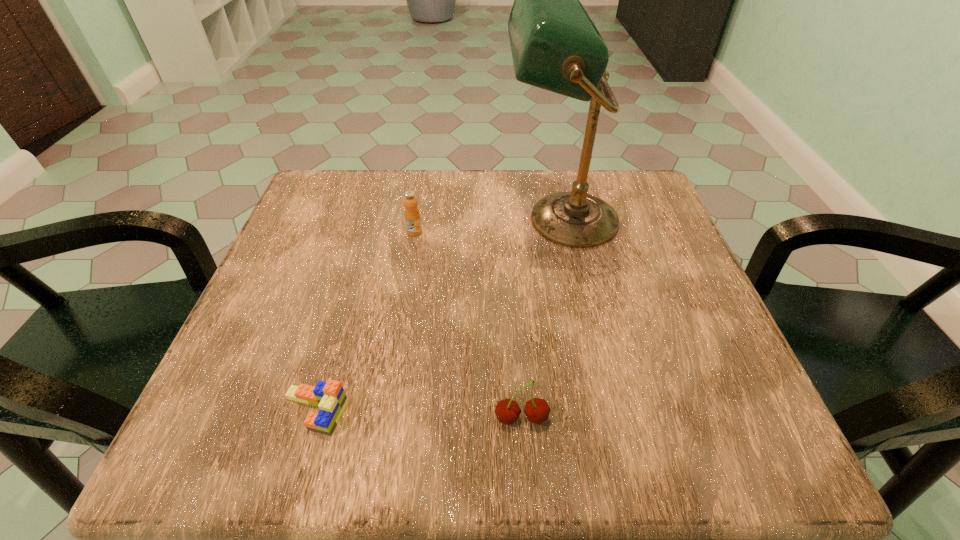
Identify the location of table lamp that is at the far edge. Image resolution: width=960 pixels, height=540 pixels. (555, 46).

At what (x,y) coordinates should I click in order to perform the action: click on orange juice present at the far edge. Please return your answer as a coordinate pair (x, y). Image resolution: width=960 pixels, height=540 pixels. Looking at the image, I should click on (412, 215).

Image resolution: width=960 pixels, height=540 pixels. Find the location of `cherry that is at the near edge`. cherry that is at the near edge is located at coordinates (537, 410).

The height and width of the screenshot is (540, 960). Identify the location of Lego located at the near edge. (330, 397).

Locate an element on the screen. The height and width of the screenshot is (540, 960). object that is at the left edge is located at coordinates (330, 397).

Find the location of a particular element. object that is at the right edge is located at coordinates (555, 46).

Where is `object present at the near left corner`? The width and height of the screenshot is (960, 540). object present at the near left corner is located at coordinates (330, 397).

At what (x,y) coordinates should I click in order to perform the action: click on object that is at the far right corner. Please return your answer as a coordinate pair (x, y). The image size is (960, 540). Looking at the image, I should click on pos(555,46).

Where is `free location at the far edge`? free location at the far edge is located at coordinates (425, 206).

Locate an element on the screen. The height and width of the screenshot is (540, 960). vacant space at the near edge of the desktop is located at coordinates (560, 441).